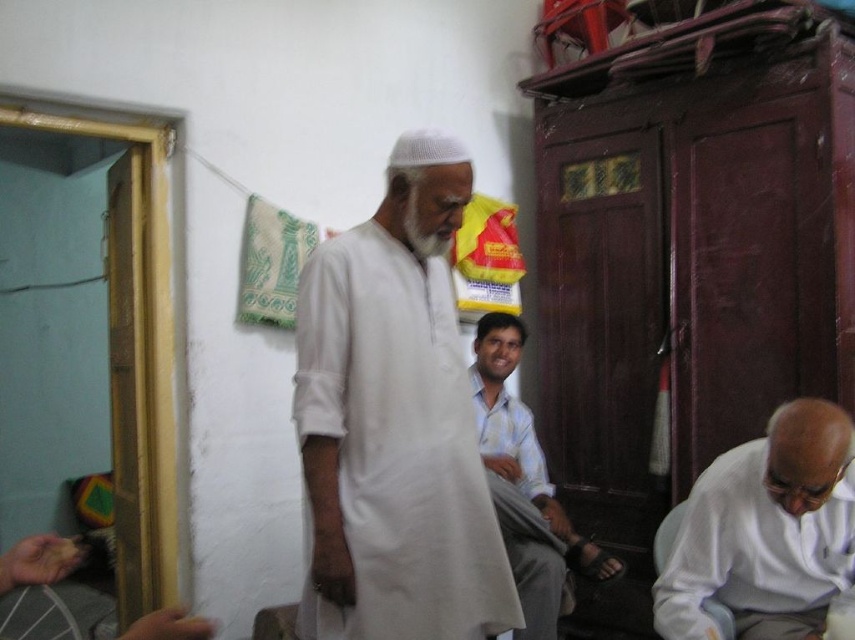
Question: Is white cotton robe at center above white matte shirt at lower right?

Choices:
 (A) no
 (B) yes

Answer: (B)

Question: Is white cotton robe at center wider than light blue cotton shirt at center?

Choices:
 (A) yes
 (B) no

Answer: (A)

Question: Which object is farther from the camera taking this photo?

Choices:
 (A) white matte shirt at lower right
 (B) white cotton robe at center
 (C) light blue cotton shirt at center

Answer: (C)

Question: Which is farther from the white cotton robe at center?

Choices:
 (A) white matte shirt at lower right
 (B) light blue cotton shirt at center

Answer: (B)

Question: Which object is farther from the camera taking this photo?

Choices:
 (A) white matte shirt at lower right
 (B) light blue cotton shirt at center

Answer: (B)

Question: Observing the image, what is the correct spatial positioning of white cotton robe at center in reference to light blue cotton shirt at center?

Choices:
 (A) below
 (B) above

Answer: (B)